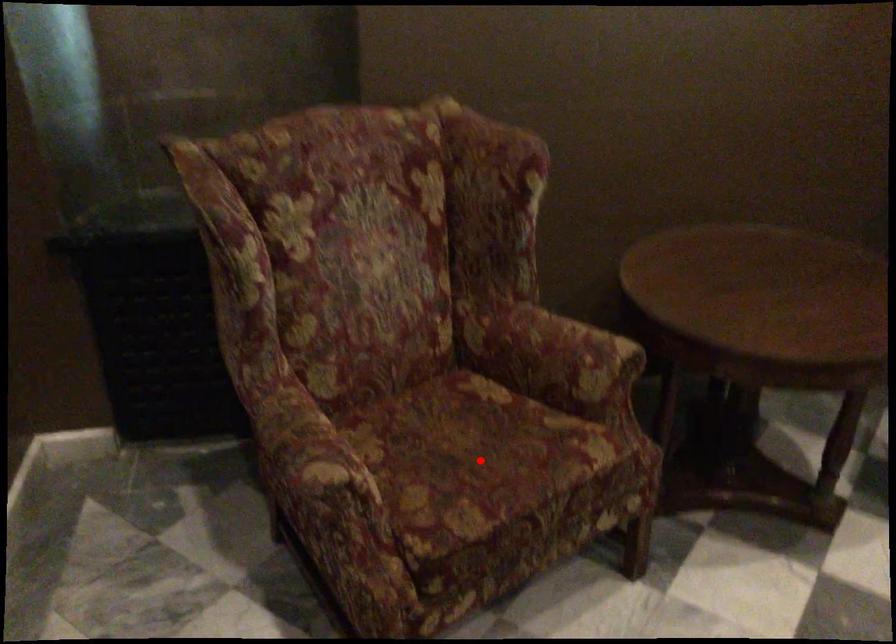
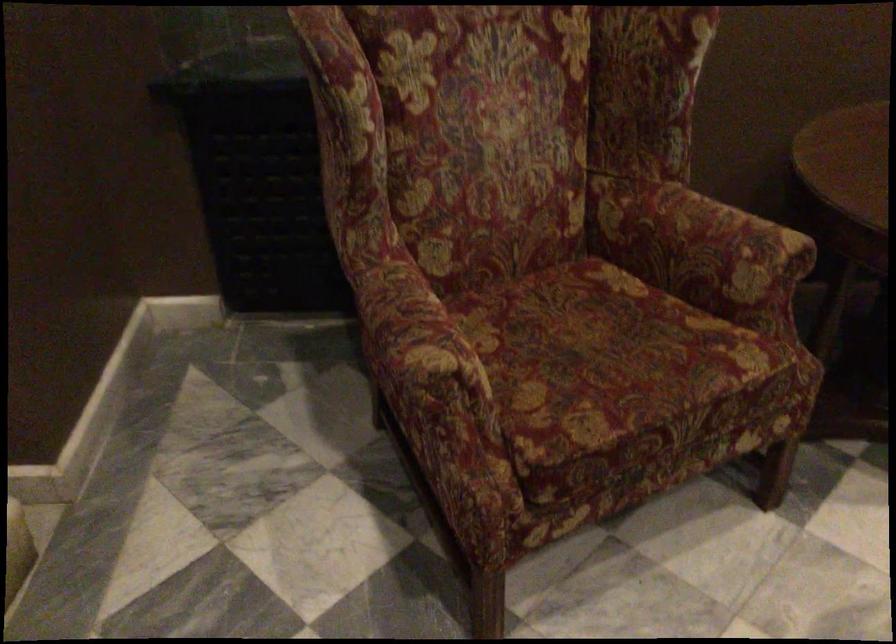
Find the pixel in the second image that matches the highlighted location in the first image.

(606, 361)